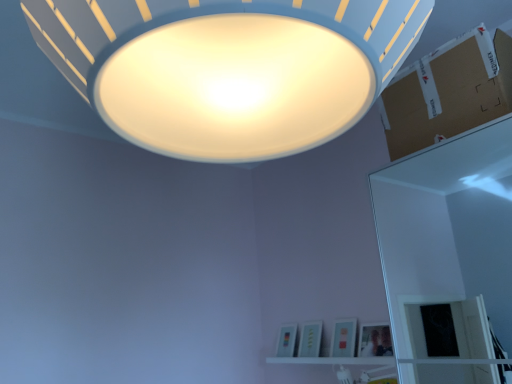
Find the location of a particular element. The image size is (512, 384). white glossy shelf at lower center is located at coordinates (333, 360).

Locate an element on the screen. Image resolution: width=512 pixels, height=384 pixels. brown cardboard at upper right is located at coordinates (448, 92).

Locate an element on the screen. This screenshot has width=512, height=384. white matte lampshade at upper center is located at coordinates (228, 67).

Does white glossy shelf at lower center turn towards brown cardboard at upper right?

No, white glossy shelf at lower center is not turned towards brown cardboard at upper right.

Would you say white glossy shelf at lower center contains brown cardboard at upper right?

Actually, brown cardboard at upper right is outside white glossy shelf at lower center.

From the image's perspective, would you say white glossy shelf at lower center is shown under brown cardboard at upper right?

Yes, from the image's perspective, white glossy shelf at lower center is beneath brown cardboard at upper right.

Is white glossy shelf at lower center smaller than brown cardboard at upper right?

Correct, white glossy shelf at lower center occupies less space than brown cardboard at upper right.

From a real-world perspective, who is located higher, white matte lampshade at upper center or white glossy shelf at lower center?

white matte lampshade at upper center, from a real-world perspective.

Between point (155, 96) and point (394, 362), which one is positioned in front?

The point (155, 96) is closer to the camera.

Is white glossy shelf at lower center inside white matte lampshade at upper center?

No, white glossy shelf at lower center is not a part of white matte lampshade at upper center.

Can you confirm if brown cardboard at upper right is taller than white matte lampshade at upper center?

Incorrect, the height of brown cardboard at upper right is not larger of that of white matte lampshade at upper center.

In terms of width, does brown cardboard at upper right look wider or thinner when compared to white matte lampshade at upper center?

Clearly, brown cardboard at upper right has less width compared to white matte lampshade at upper center.

Which is behind, point (446, 126) or point (99, 0)?

The point (446, 126) is farther.

From the image's perspective, who appears lower, brown cardboard at upper right or white matte lampshade at upper center?

brown cardboard at upper right appears lower in the image.

From their relative heights in the image, would you say brown cardboard at upper right is taller or shorter than white glossy shelf at lower center?

Considering their sizes, brown cardboard at upper right has more height than white glossy shelf at lower center.

Is brown cardboard at upper right in front of or behind white glossy shelf at lower center in the image?

brown cardboard at upper right is positioned closer to the viewer than white glossy shelf at lower center.

Would you consider brown cardboard at upper right to be distant from white glossy shelf at lower center?

Indeed, brown cardboard at upper right is not near white glossy shelf at lower center.

Is brown cardboard at upper right outside of white glossy shelf at lower center?

Yes.

Is white matte lampshade at upper center closer to the viewer compared to brown cardboard at upper right?

Yes.

From a real-world perspective, is white matte lampshade at upper center positioned over brown cardboard at upper right based on gravity?

No, from a real-world perspective, white matte lampshade at upper center is not on top of brown cardboard at upper right.

Is white matte lampshade at upper center directly adjacent to brown cardboard at upper right?

white matte lampshade at upper center is not next to brown cardboard at upper right, and they're not touching.

Is white glossy shelf at lower center facing towards white matte lampshade at upper center?

No, white glossy shelf at lower center is not turned towards white matte lampshade at upper center.

Do you think white glossy shelf at lower center is within white matte lampshade at upper center, or outside of it?

white glossy shelf at lower center cannot be found inside white matte lampshade at upper center.

Identify the location of shelf on the right of white matte lampshade at upper center. (333, 360).

Considering the relative sizes of white glossy shelf at lower center and white matte lampshade at upper center in the image provided, is white glossy shelf at lower center bigger than white matte lampshade at upper center?

No.

Where is `shelf behind the brown cardboard at upper right`? Image resolution: width=512 pixels, height=384 pixels. shelf behind the brown cardboard at upper right is located at coordinates (333, 360).

Where is `lamp above the white glossy shelf at lower center (from the image's perspective)`? The image size is (512, 384). lamp above the white glossy shelf at lower center (from the image's perspective) is located at coordinates (228, 67).

From the image, which object appears to be nearer to brown cardboard at upper right, white matte lampshade at upper center or white glossy shelf at lower center?

white matte lampshade at upper center is closer to brown cardboard at upper right.

Which object lies further to the anchor point brown cardboard at upper right, white glossy shelf at lower center or white matte lampshade at upper center?

The object further to brown cardboard at upper right is white glossy shelf at lower center.

From the image, which object appears to be farther from white matte lampshade at upper center, white glossy shelf at lower center or brown cardboard at upper right?

Among the two, white glossy shelf at lower center is located further to white matte lampshade at upper center.

Based on their spatial positions, is white matte lampshade at upper center or brown cardboard at upper right closer to white glossy shelf at lower center?

brown cardboard at upper right.

Consider the image. Based on their spatial positions, is brown cardboard at upper right or white glossy shelf at lower center closer to white matte lampshade at upper center?

Among the two, brown cardboard at upper right is located nearer to white matte lampshade at upper center.

From the image, which object appears to be nearer to white glossy shelf at lower center, brown cardboard at upper right or white matte lampshade at upper center?

brown cardboard at upper right is positioned closer to the anchor white glossy shelf at lower center.

Image resolution: width=512 pixels, height=384 pixels. Find the location of `cardboard box between white matte lampshade at upper center and white glossy shelf at lower center along the z-axis`. cardboard box between white matte lampshade at upper center and white glossy shelf at lower center along the z-axis is located at coordinates (448, 92).